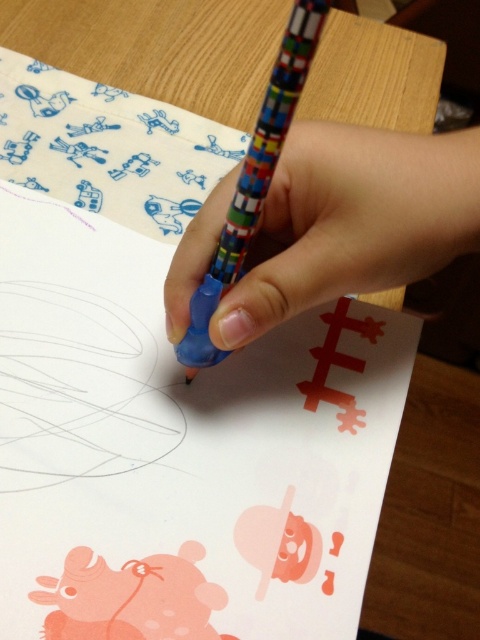
Question: Is rubberized plastic pencil at center thinner than multicolored plastic pencil at center?

Choices:
 (A) no
 (B) yes

Answer: (A)

Question: Does rubberized plastic pencil at center come in front of multicolored plastic pencil at center?

Choices:
 (A) no
 (B) yes

Answer: (A)

Question: Can you confirm if rubberized plastic pencil at center is positioned above multicolored plastic pencil at center?

Choices:
 (A) yes
 (B) no

Answer: (A)

Question: Which point appears farthest from the camera in this image?

Choices:
 (A) (252, 170)
 (B) (323, 192)

Answer: (B)